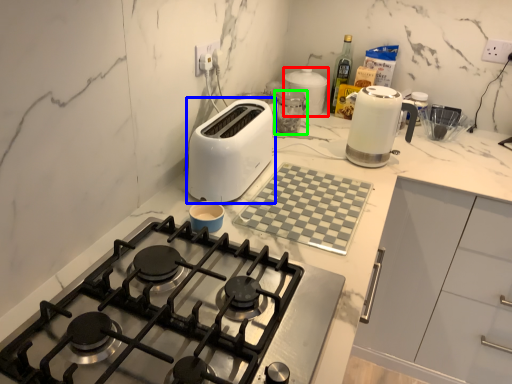
Question: Considering the real-world distances, which object is farthest from kitchen appliance (highlighted by a red box)? toaster (highlighted by a blue box) or kitchen appliance (highlighted by a green box)?

Choices:
 (A) toaster
 (B) kitchen appliance

Answer: (A)